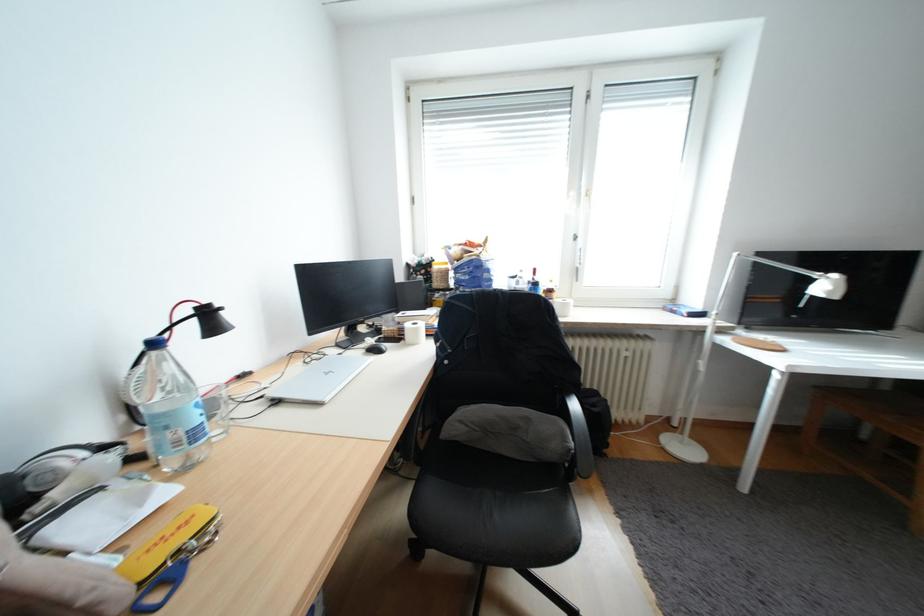
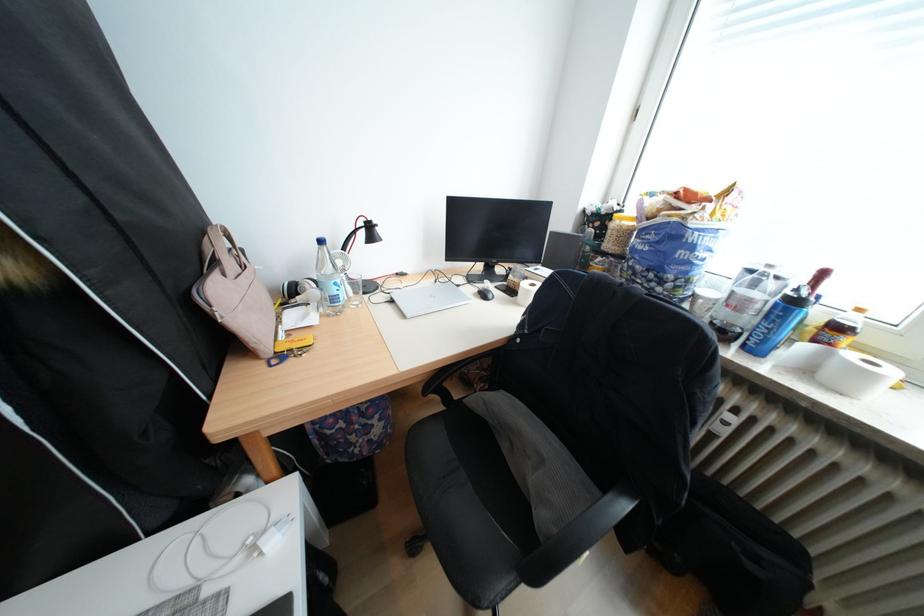
In the second image, find the point that corresponds to (x=548, y=285) in the first image.

(808, 302)